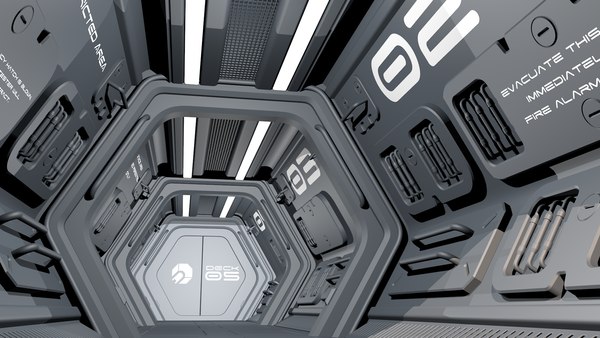
Where is `vents`? The width and height of the screenshot is (600, 338). vents is located at coordinates (498, 336), (442, 335), (398, 332).